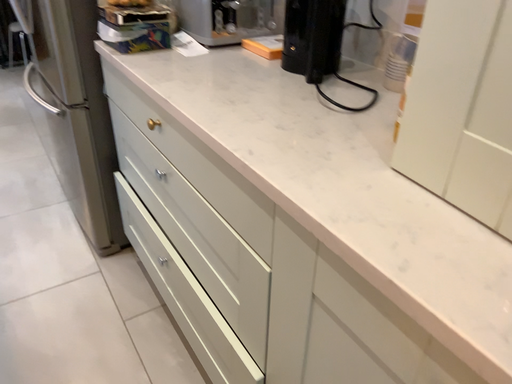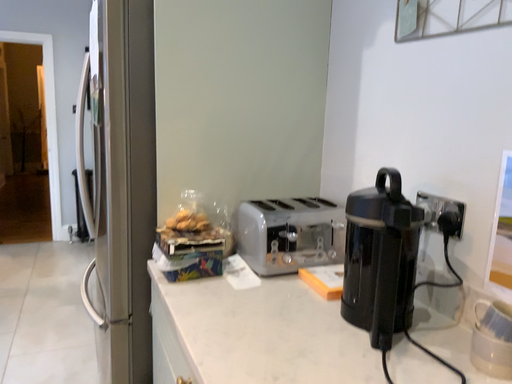
Question: Which way did the camera rotate in the video?

Choices:
 (A) rotated left
 (B) rotated right

Answer: (A)